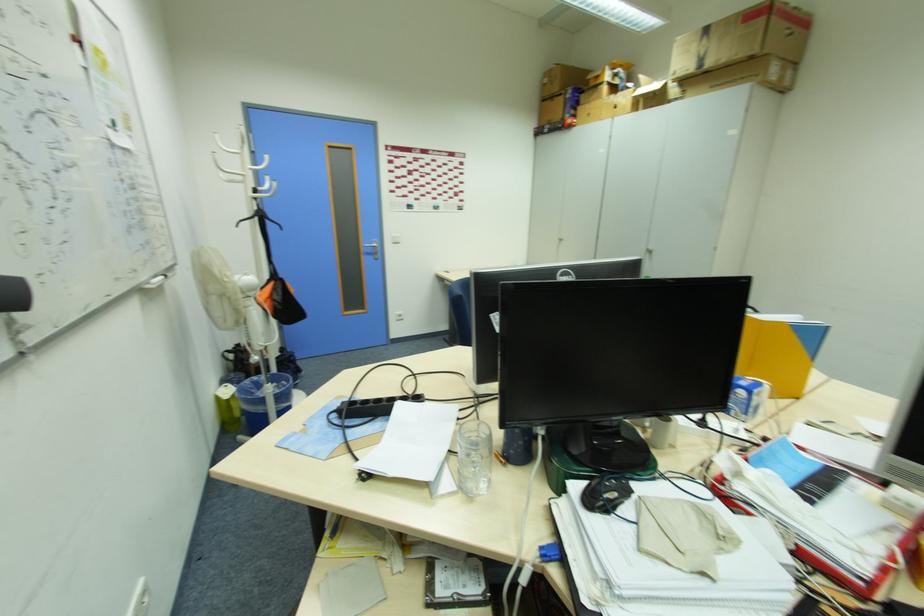
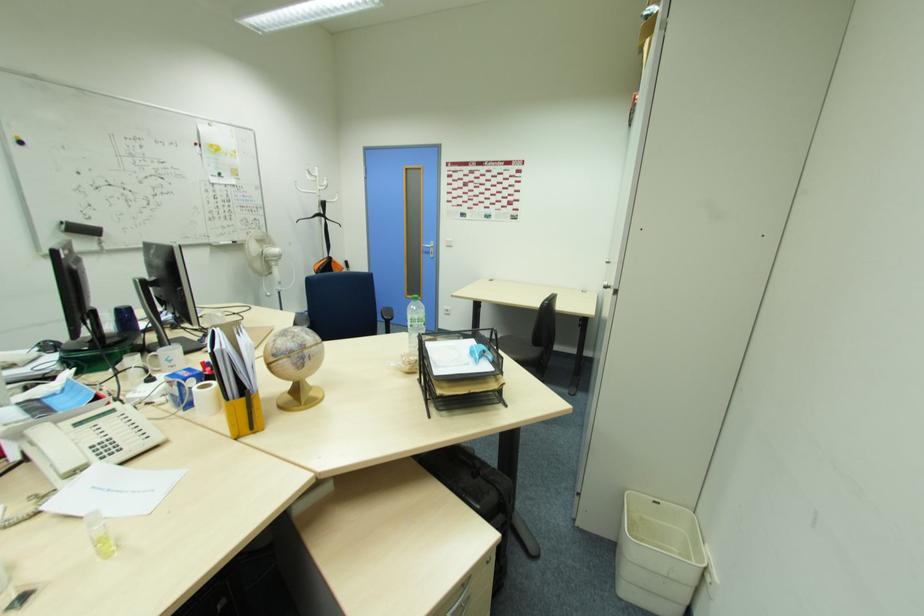
The point at (371, 252) is marked in the first image. Where is the corresponding point in the second image?

(430, 252)